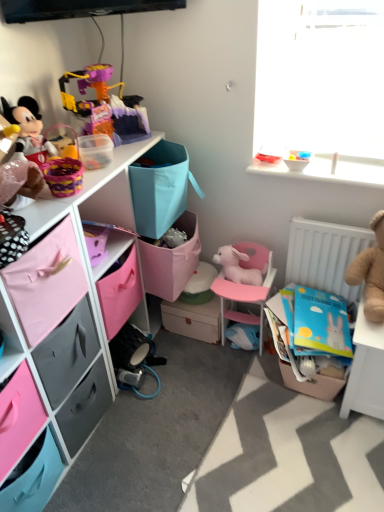
Where is `vacant area in front of matte pink storage box at center, which is the first storage box in left-to-right order`? vacant area in front of matte pink storage box at center, which is the first storage box in left-to-right order is located at coordinates (193, 362).